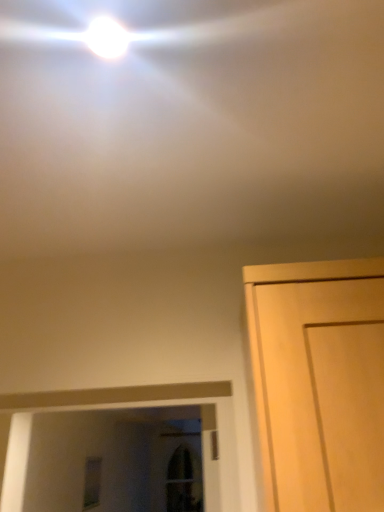
What is the approximate width of clear glass window at lower left?

It is 2.34 inches.

You are a GUI agent. You are given a task and a screenshot of the screen. Output one action in this format:
    pyautogui.click(x=<x>, y=<y>)
    Task: Click on the white glossy droplight at upper center
    Image resolution: width=384 pixels, height=512 pixels.
    Given the screenshot: What is the action you would take?
    pyautogui.click(x=107, y=38)

Which of these two, clear glass window at lower left or white glossy droplight at upper center, stands taller?

With more height is clear glass window at lower left.

Can you confirm if clear glass window at lower left is positioned to the left of white glossy droplight at upper center?

Correct, you'll find clear glass window at lower left to the left of white glossy droplight at upper center.

Is white glossy droplight at upper center a part of clear glass window at lower left?

Actually, white glossy droplight at upper center is outside clear glass window at lower left.

Is point (91, 508) more distant than point (117, 22)?

Yes, it is behind point (117, 22).

Is white glossy droplight at upper center aimed at clear glass window at lower left?

No, white glossy droplight at upper center is not turned towards clear glass window at lower left.

In terms of height, does white glossy droplight at upper center look taller or shorter compared to clear glass window at lower left?

Answer: white glossy droplight at upper center is shorter than clear glass window at lower left.

From a real-world perspective, is white glossy droplight at upper center below clear glass window at lower left?

No, from a real-world perspective, white glossy droplight at upper center is not under clear glass window at lower left.

Is white glossy droplight at upper center to the right of clear glass window at lower left from the viewer's perspective?

Yes.

How distant is light wood door at right from white glossy droplight at upper center?

The distance of light wood door at right from white glossy droplight at upper center is 62.49 centimeters.

Is light wood door at right shorter than white glossy droplight at upper center?

In fact, light wood door at right may be taller than white glossy droplight at upper center.

The height and width of the screenshot is (512, 384). I want to click on droplight above the light wood door at right (from the image's perspective), so click(107, 38).

From the image's perspective, which is above, light wood door at right or white glossy droplight at upper center?

From the image's view, white glossy droplight at upper center is above.

How many degrees apart are the facing directions of white glossy droplight at upper center and light wood door at right?

The angle between the facing direction of white glossy droplight at upper center and the facing direction of light wood door at right is 1.33 degrees.

Is white glossy droplight at upper center not near light wood door at right?

white glossy droplight at upper center is actually quite close to light wood door at right.

Is white glossy droplight at upper center oriented towards light wood door at right?

No, white glossy droplight at upper center is not facing towards light wood door at right.

Does white glossy droplight at upper center have a greater height compared to light wood door at right?

Incorrect, the height of white glossy droplight at upper center is not larger of that of light wood door at right.

Can you confirm if clear glass window at lower left is smaller than light wood door at right?

Yes.

Are clear glass window at lower left and light wood door at right located far from each other?

Yes.

In the scene shown: Which object is wider, clear glass window at lower left or light wood door at right?

Wider between the two is light wood door at right.

Considering the positions of points (95, 463) and (296, 434), is point (95, 463) closer to camera compared to point (296, 434)?

No, (95, 463) is behind (296, 434).

Considering the positions of point (296, 419) and point (101, 463), is point (296, 419) closer or farther from the camera than point (101, 463)?

Point (296, 419) is closer to the camera than point (101, 463).

From the image's perspective, is light wood door at right positioned above or below clear glass window at lower left?

light wood door at right is above clear glass window at lower left.

Choose the correct answer: Is light wood door at right inside clear glass window at lower left or outside it?

light wood door at right is spatially situated outside clear glass window at lower left.

Between light wood door at right and clear glass window at lower left, which one has smaller size?

Smaller between the two is clear glass window at lower left.

You are a GUI agent. You are given a task and a screenshot of the screen. Output one action in this format:
    pyautogui.click(x=<x>, y=<y>)
    Task: Click on the droplight that appears in front of the clear glass window at lower left
    Image resolution: width=384 pixels, height=512 pixels.
    Given the screenshot: What is the action you would take?
    pyautogui.click(x=107, y=38)

The width and height of the screenshot is (384, 512). In order to click on droplight that is above the clear glass window at lower left (from the image's perspective) in this screenshot , I will do `click(107, 38)`.

Looking at the image, which one is located closer to white glossy droplight at upper center, clear glass window at lower left or light wood door at right?

Based on the image, light wood door at right appears to be nearer to white glossy droplight at upper center.

When comparing their distances from clear glass window at lower left, does light wood door at right or white glossy droplight at upper center seem further?

white glossy droplight at upper center is further to clear glass window at lower left.

From the image, which object appears to be nearer to clear glass window at lower left, white glossy droplight at upper center or light wood door at right?

light wood door at right lies closer to clear glass window at lower left than the other object.

Based on their spatial positions, is clear glass window at lower left or white glossy droplight at upper center further from light wood door at right?

Among the two, clear glass window at lower left is located further to light wood door at right.

Based on their spatial positions, is light wood door at right or clear glass window at lower left further from white glossy droplight at upper center?

Among the two, clear glass window at lower left is located further to white glossy droplight at upper center.

Estimate the real-world distances between objects in this image. Which object is further from light wood door at right, white glossy droplight at upper center or clear glass window at lower left?

Among the two, clear glass window at lower left is located further to light wood door at right.

Find the location of `droplight between light wood door at right and clear glass window at lower left from front to back`. droplight between light wood door at right and clear glass window at lower left from front to back is located at coordinates (107, 38).